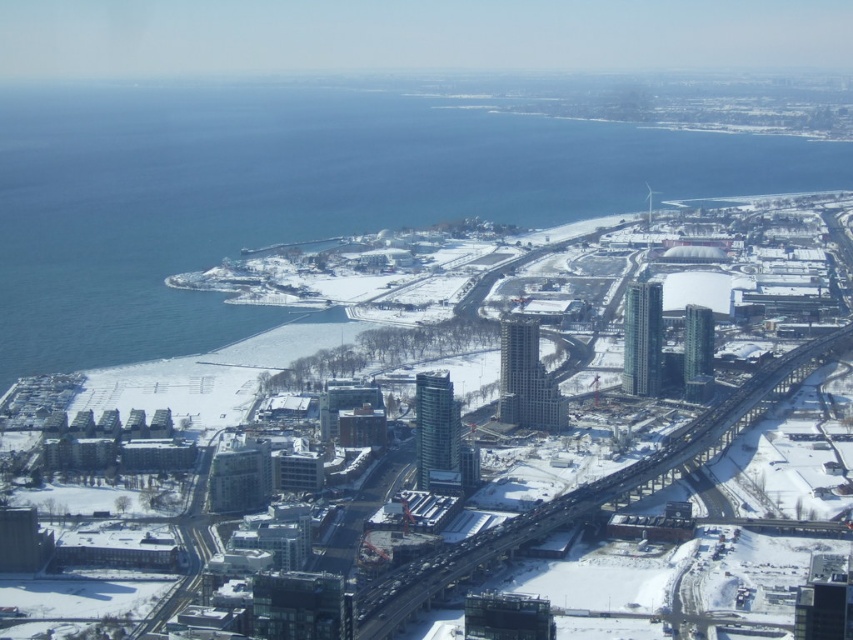
You are a drone operator flying over the city. Your task is to deliver a package to the white matte snow at center and then to the blue water at lower left. Which location should you visit first if you want to descend from a higher altitude to a lower altitude?

The white matte snow at center is below blue water at lower left, so you should deliver the package to the white matte snow at center first as it is at a lower altitude than the blue water at lower left.

In the scene shown: You are a city planner analyzing a winter aerial view of a city. You see the white matte snow at center. Based on its coordinates, where exactly is the white matte snow located in the image?

The white matte snow at center is located at the coordinates point (404, 422) in the image.